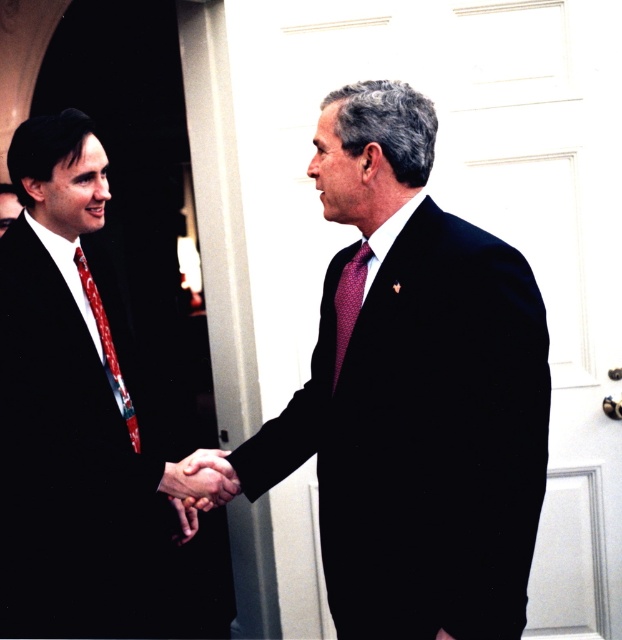
Question: From the image, what is the correct spatial relationship of matte black suit at left in relation to red-patterned tie at left?

Choices:
 (A) left
 (B) right

Answer: (A)

Question: Can you confirm if matte black suit at left is positioned to the right of smooth skin handshake at center?

Choices:
 (A) yes
 (B) no

Answer: (B)

Question: Which is nearer to the matte black suit at left?

Choices:
 (A) maroon textured tie at center
 (B) red-patterned tie at left

Answer: (B)

Question: Does maroon textured tie at center appear on the right side of red-patterned tie at left?

Choices:
 (A) no
 (B) yes

Answer: (B)

Question: Which object is the closest to the maroon textured tie at center?

Choices:
 (A) matte black suit at center
 (B) red-patterned tie at left
 (C) smooth skin handshake at center

Answer: (A)

Question: Which point is closer to the camera taking this photo?

Choices:
 (A) (335, 298)
 (B) (80, 129)
 (C) (106, 344)

Answer: (A)